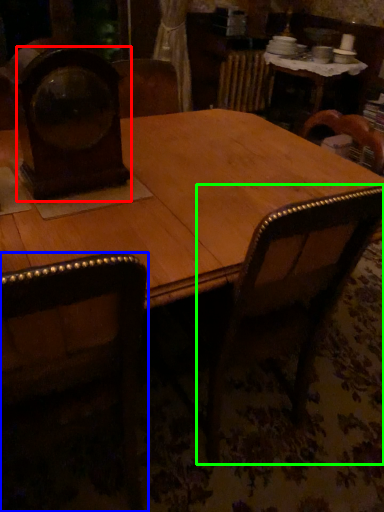
Question: Which object is the closest to the clock (highlighted by a red box)? Choose among these: chair (highlighted by a blue box) or armchair (highlighted by a green box).

Choices:
 (A) chair
 (B) armchair

Answer: (A)